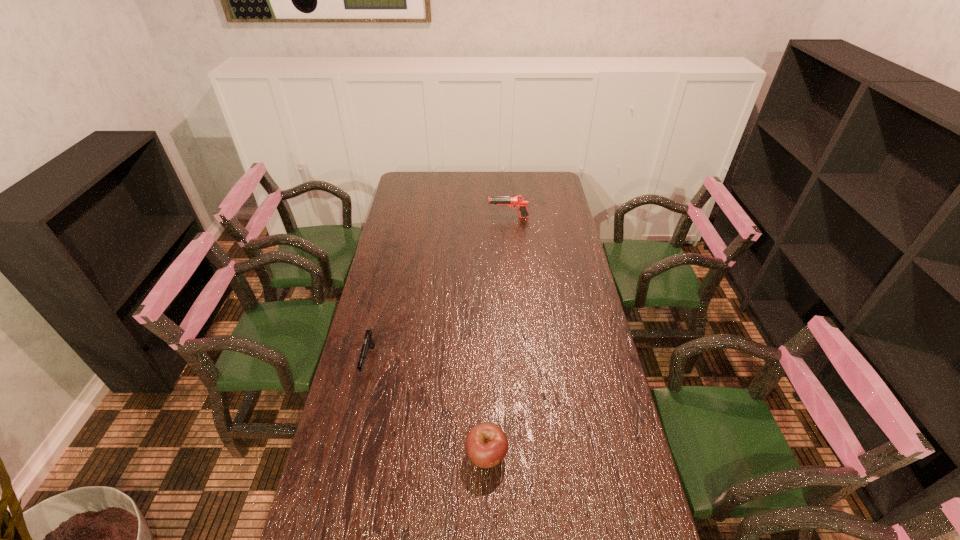
Image resolution: width=960 pixels, height=540 pixels. I want to click on free space that is in between the farthest object and the second nearest object, so click(x=439, y=289).

The height and width of the screenshot is (540, 960). In order to click on object that is the closest to the tallest object in this screenshot , I will do `click(368, 340)`.

Find the location of `object that is the second nearest to the leftmost object`. object that is the second nearest to the leftmost object is located at coordinates click(518, 201).

Select which gun appears as the second closest to the apple. Please provide its 2D coordinates. Your answer should be formatted as a tuple, i.e. [(x, y)], where the tuple contains the x and y coordinates of a point satisfying the conditions above.

[(518, 201)]

Locate which gun ranks second in proximity to the nearest object. Please provide its 2D coordinates. Your answer should be formatted as a tuple, i.e. [(x, y)], where the tuple contains the x and y coordinates of a point satisfying the conditions above.

[(518, 201)]

I want to click on vacant space that satisfies the following two spatial constraints: 1. at the aiming end of the tallest object; 2. on the side of the nearest object with the unique marking, so click(529, 455).

Find the location of a particular element. The width and height of the screenshot is (960, 540). vacant space that satisfies the following two spatial constraints: 1. at the aiming end of the tallest object; 2. at the aiming end of the leftmost object is located at coordinates (520, 361).

This screenshot has height=540, width=960. What are the coordinates of `vacant point that satisfies the following two spatial constraints: 1. at the aiming end of the farther gun; 2. at the aiming end of the nearer gun` in the screenshot? It's located at (520, 361).

Where is `vacant region that satisfies the following two spatial constraints: 1. at the aiming end of the right gun; 2. on the side of the nearest object with the unique marking`? vacant region that satisfies the following two spatial constraints: 1. at the aiming end of the right gun; 2. on the side of the nearest object with the unique marking is located at coordinates (529, 455).

At what (x,y) coordinates should I click in order to perform the action: click on vacant area that satisfies the following two spatial constraints: 1. at the aiming end of the tallest object; 2. at the aiming end of the leftmost object. Please return your answer as a coordinate pair (x, y). The image size is (960, 540). Looking at the image, I should click on [520, 361].